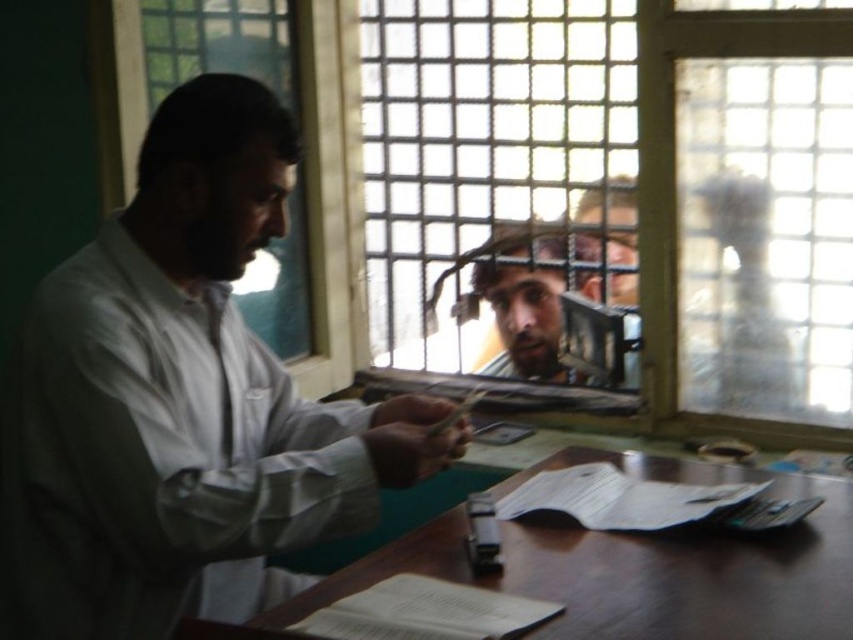
You are a customer trying to hand over payment to the person behind the clear glass window at center. The white matte shirt at center is the person you need to reach. Can you directly hand the payment to them, or do you need to use another method?

The clear glass window at center is positioned over white matte shirt at center, so you cannot directly hand the payment to them. You would need to use a slot or tray provided at the counter to pass the payment through the clear glass window at center to the white matte shirt at center.

You are standing in front of the counter and want to hand over some documents to the man behind the clear glass window at center. Based on the scene, can you estimate where you should aim to place the documents so they reach him?

The clear glass window at center is located at point coordinates of (625, 189), so you should aim to place the documents near that position to ensure they reach the man behind the window.

You are a customer trying to place an order at the counter. You need to slide your payment across the wooden table at center to the white matte shirt at center. Can you slide it directly between them without moving any items on the table?

The white matte shirt at center is thinner than the wooden table at center, so there is enough space between them to slide the payment directly without moving items on the table.